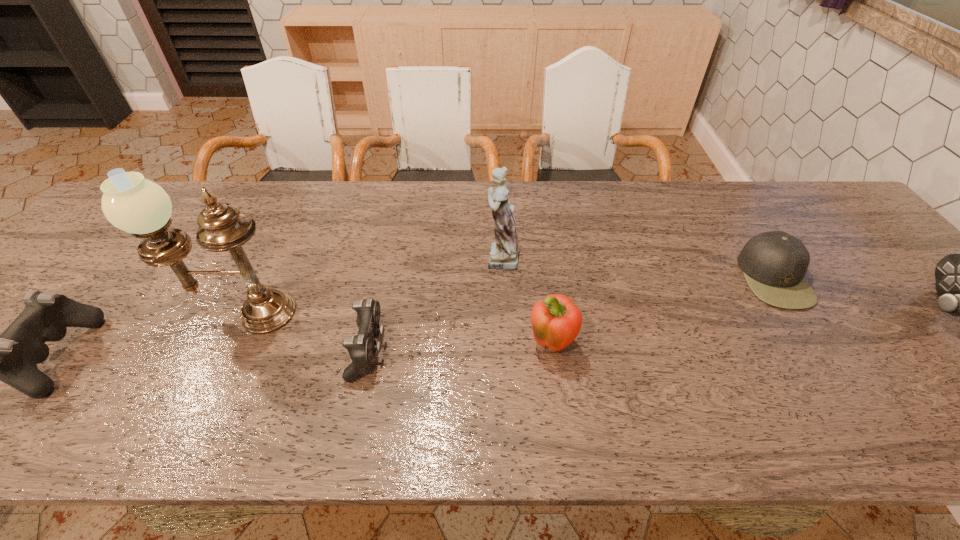
To achieve uniform spacing by inserting another control among them, please point to a free space for this new control. Please provide its 2D coordinates. Your answer should be formatted as a tuple, i.e. [(x, y)], where the tuple contains the x and y coordinates of a point satisfying the conditions above.

[(669, 343)]